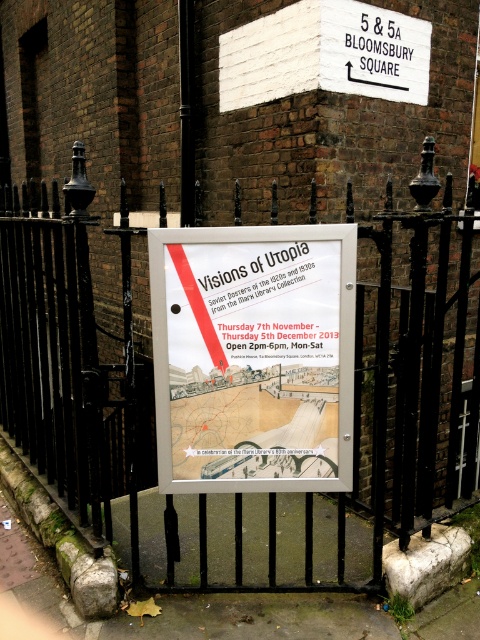
Question: Among these objects, which one is nearest to the camera?

Choices:
 (A) black metal fence at center
 (B) white paper poster at center

Answer: (A)

Question: Which of the following is the closest to the observer?

Choices:
 (A) black metal fence at center
 (B) white paper poster at center

Answer: (A)

Question: Which object is closer to the camera taking this photo?

Choices:
 (A) white paper poster at center
 (B) black metal fence at center

Answer: (B)

Question: From the image, what is the correct spatial relationship of black metal fence at center in relation to white paper poster at center?

Choices:
 (A) below
 (B) above

Answer: (B)

Question: Does black metal fence at center have a larger size compared to white paper poster at center?

Choices:
 (A) yes
 (B) no

Answer: (A)

Question: Can you confirm if black metal fence at center is positioned to the right of white paper poster at center?

Choices:
 (A) yes
 (B) no

Answer: (B)